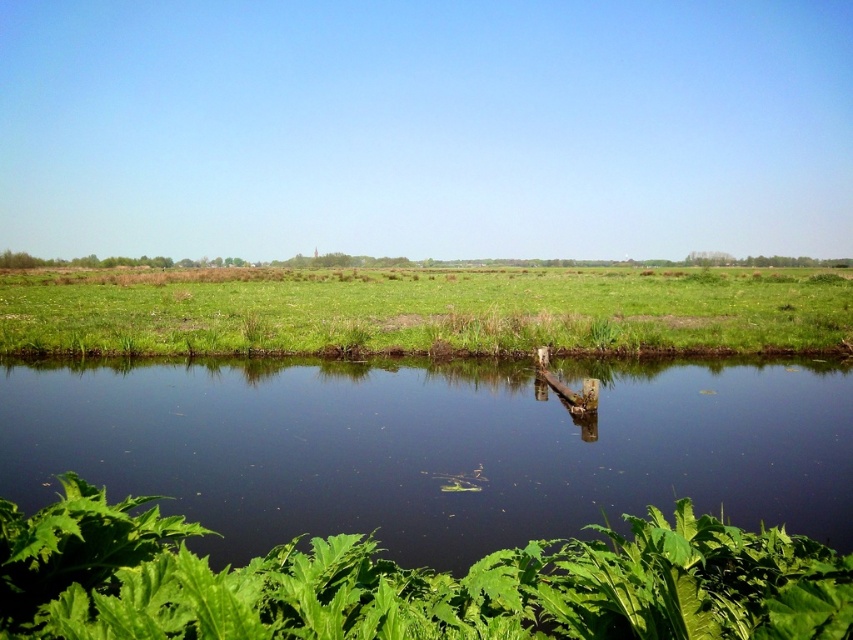
Question: Based on their relative distances, which object is farther from the green grass at center?

Choices:
 (A) green leafy plant at lower center
 (B) green leafy plants at lower center

Answer: (A)

Question: From the image, what is the correct spatial relationship of green leafy plant at lower center in relation to green grass at center?

Choices:
 (A) above
 (B) below

Answer: (B)

Question: Is green leafy plant at lower center above green grass at center?

Choices:
 (A) no
 (B) yes

Answer: (A)

Question: Which of the following is the farthest from the observer?

Choices:
 (A) (660, 532)
 (B) (236, 524)
 (C) (109, 321)

Answer: (C)

Question: Can you confirm if green leafy plant at lower center is positioned above green grass at center?

Choices:
 (A) yes
 (B) no

Answer: (B)

Question: Estimate the real-world distances between objects in this image. Which object is farther from the green leafy plants at lower center?

Choices:
 (A) green grass at center
 (B) green leafy plant at lower center

Answer: (A)